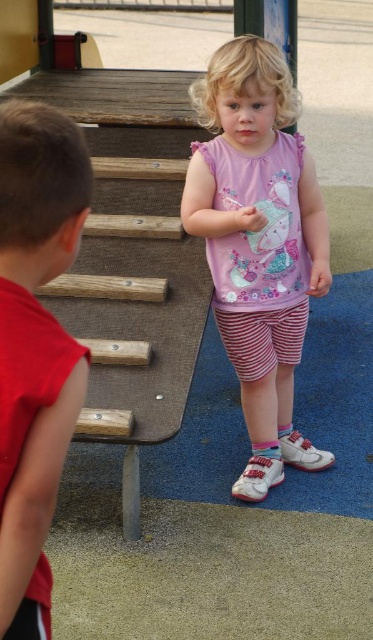
Question: Is pink fabric shirt at center thinner than red fabric sleeveless shirt at left?

Choices:
 (A) yes
 (B) no

Answer: (B)

Question: Is the position of pink fabric shirt at center more distant than that of red fabric sleeveless shirt at left?

Choices:
 (A) yes
 (B) no

Answer: (A)

Question: Which of the following is the farthest from the observer?

Choices:
 (A) pink fabric shirt at center
 (B) red fabric sleeveless shirt at left

Answer: (A)

Question: Which point is closer to the camera taking this photo?

Choices:
 (A) pyautogui.click(x=17, y=326)
 (B) pyautogui.click(x=290, y=339)

Answer: (A)

Question: Does pink fabric shirt at center appear over red fabric sleeveless shirt at left?

Choices:
 (A) yes
 (B) no

Answer: (A)